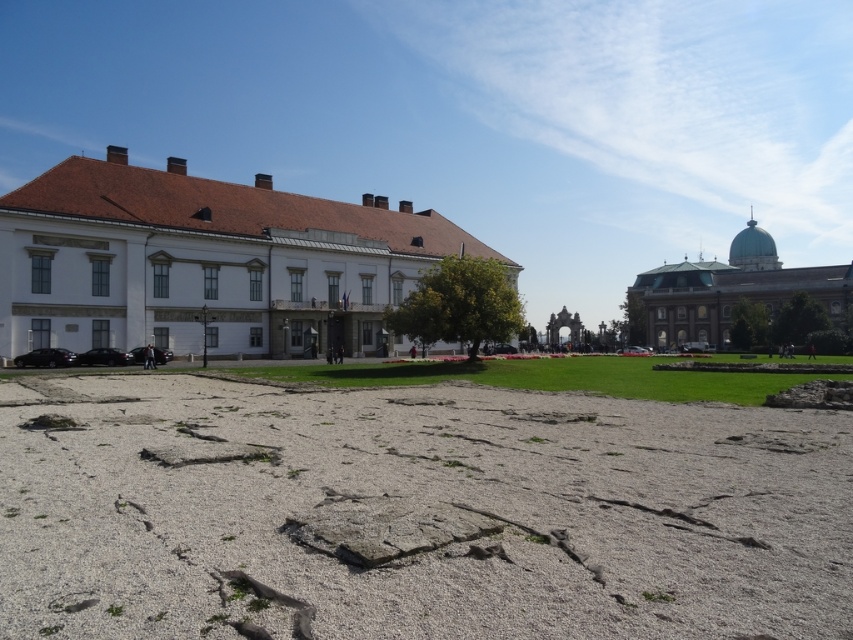
Does point (628, 292) lie behind point (560, 310)?

No, it is not.

Between green dome building at upper right and matte stone arch at center, which one has more height?

green dome building at upper right is taller.

What do you see at coordinates (728, 291) in the screenshot? I see `green dome building at upper right` at bounding box center [728, 291].

Find the location of a particular element. Image resolution: width=853 pixels, height=640 pixels. green dome building at upper right is located at coordinates (728, 291).

Does white smooth building at center have a lesser height compared to matte stone arch at center?

Incorrect, white smooth building at center's height does not fall short of matte stone arch at center's.

Consider the image. Is white smooth building at center bigger than matte stone arch at center?

Indeed, white smooth building at center has a larger size compared to matte stone arch at center.

Find the location of a particular element. This screenshot has width=853, height=640. white smooth building at center is located at coordinates (206, 260).

Locate an element on the screen. white smooth building at center is located at coordinates (206, 260).

Does white smooth building at center have a lesser height compared to green dome building at upper right?

Indeed, white smooth building at center has a lesser height compared to green dome building at upper right.

Describe the element at coordinates (206, 260) in the screenshot. The width and height of the screenshot is (853, 640). I see `white smooth building at center` at that location.

You are a GUI agent. You are given a task and a screenshot of the screen. Output one action in this format:
    pyautogui.click(x=<x>, y=<y>)
    Task: Click on the white smooth building at center
    The height and width of the screenshot is (640, 853).
    Given the screenshot: What is the action you would take?
    206,260